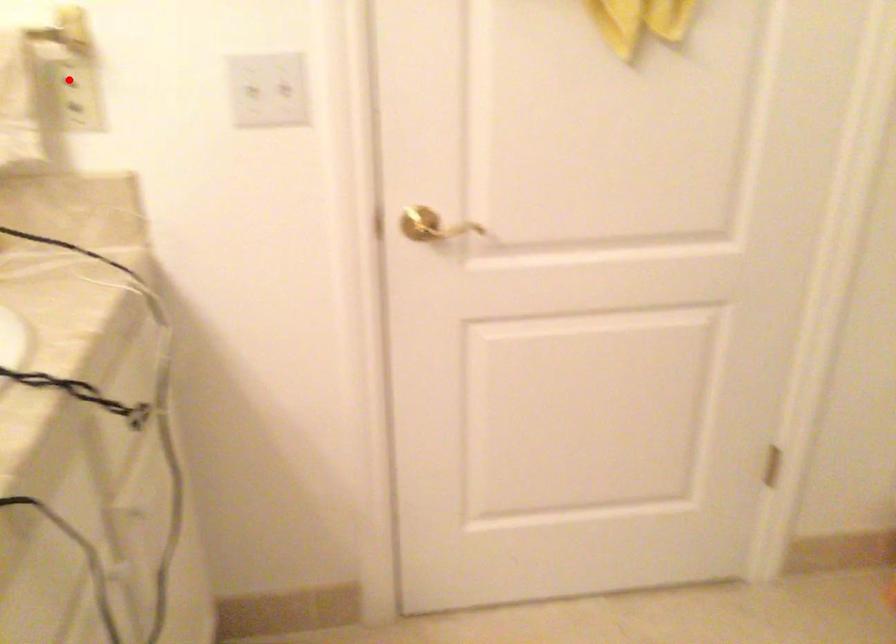
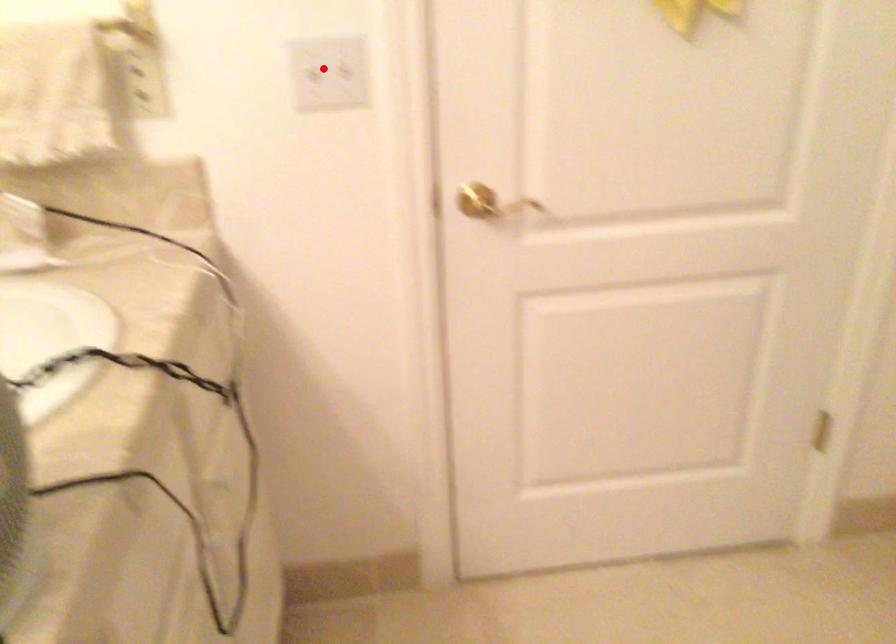
Based on the photo, I am providing you with two images of the same scene from different viewpoints. A red point is marked on the first image and another point is marked on the second image. Is the marked point in image1 the same physical position as the marked point in image2?

No